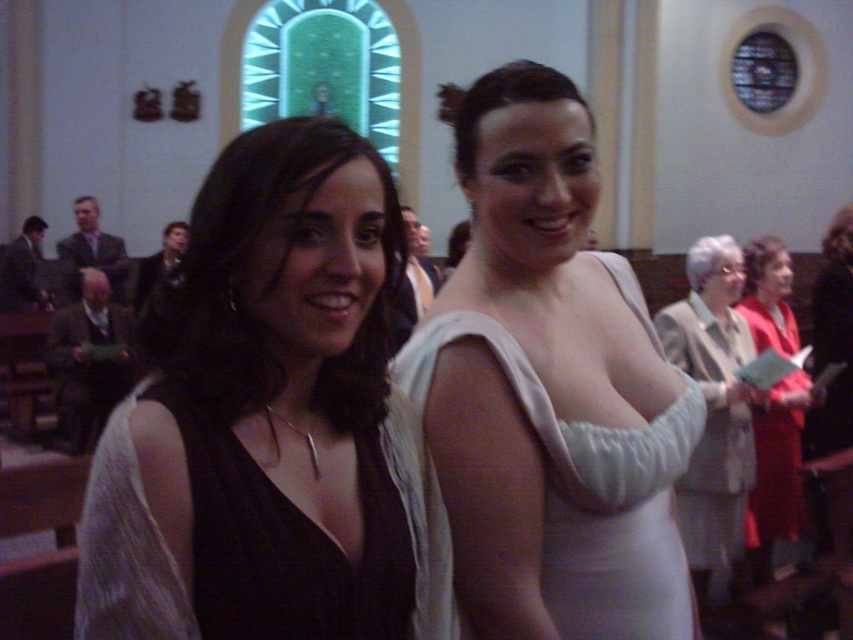
You are a photographer setting up for a photoshoot in this church scene. You need to position a large camera tripod between the white satin dress at center and the red satin dress at right. Considering their widths, which dress should you place the tripod closer to to ensure enough space?

The white satin dress at center has a larger width than the red satin dress at right, so you should place the tripod closer to the red satin dress at right to ensure there is enough space between them.

You are attending a formal event and see two dresses displayed at the center of the room. The matte black dress at center and the light beige fabric dress at center. Which dress is shorter in height?

The matte black dress at center is not as tall as the light beige fabric dress at center, so the matte black dress at center is shorter in height.

You are standing in the church and want to take a photo of the point at coordinate (619, 572). Your camera has a focal length of 50mm and a sensor size of 24mm x 36mm. What is the minimum distance you need to move forward to ensure the point fills the frame vertically?

The point at coordinate (619, 572) is 20.72 meters away. To calculate the minimum distance needed, use the formula distance_new 20.72m. Thus, you need to move forward to 20.72 meters minus the calculated difference to fill the frame vertically.